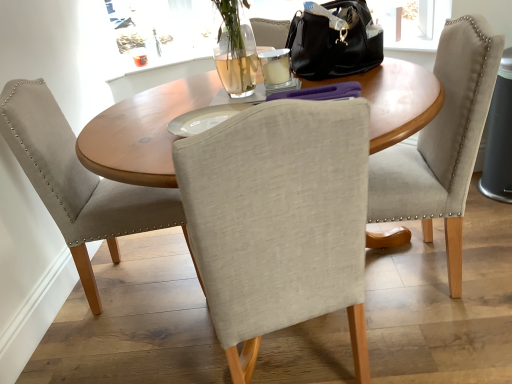
Question: Can you confirm if black leather handbag at upper center is positioned to the left of wooden table at center?

Choices:
 (A) no
 (B) yes

Answer: (A)

Question: Is black leather handbag at upper center next to wooden table at center?

Choices:
 (A) yes
 (B) no

Answer: (B)

Question: Is black leather handbag at upper center smaller than wooden table at center?

Choices:
 (A) yes
 (B) no

Answer: (A)

Question: From the image's perspective, is black leather handbag at upper center above wooden table at center?

Choices:
 (A) yes
 (B) no

Answer: (A)

Question: From a real-world perspective, is black leather handbag at upper center positioned under wooden table at center based on gravity?

Choices:
 (A) no
 (B) yes

Answer: (A)

Question: From the image's perspective, is light gray fabric chair at left, placed as the 1th chair when sorted from left to right, above or below light gray fabric chair at center, acting as the 2th chair starting from the left?

Choices:
 (A) below
 (B) above

Answer: (A)

Question: Is point (37, 148) closer or farther from the camera than point (378, 205)?

Choices:
 (A) closer
 (B) farther

Answer: (B)

Question: In terms of size, does light gray fabric chair at left, placed as the 1th chair when sorted from left to right, appear bigger or smaller than light gray fabric chair at center, which appears as the 1th chair when viewed from the right?

Choices:
 (A) small
 (B) big

Answer: (A)

Question: Considering their positions, is light gray fabric chair at left, placed as the 1th chair when sorted from left to right, located in front of or behind light gray fabric chair at center, which appears as the 1th chair when viewed from the right?

Choices:
 (A) behind
 (B) front

Answer: (A)

Question: Considering the positions of light gray fabric chair at left, the 2th chair positioned from the right, and black leather handbag at upper center in the image, is light gray fabric chair at left, the 2th chair positioned from the right, taller or shorter than black leather handbag at upper center?

Choices:
 (A) tall
 (B) short

Answer: (A)

Question: From a real-world perspective, relative to black leather handbag at upper center, is light gray fabric chair at left, placed as the 1th chair when sorted from left to right, vertically above or below?

Choices:
 (A) below
 (B) above

Answer: (A)

Question: Visually, is light gray fabric chair at left, placed as the 1th chair when sorted from left to right, positioned to the left or to the right of black leather handbag at upper center?

Choices:
 (A) right
 (B) left

Answer: (B)

Question: Relative to black leather handbag at upper center, is light gray fabric chair at left, placed as the 1th chair when sorted from left to right, in front or behind?

Choices:
 (A) behind
 (B) front

Answer: (B)

Question: From a real-world perspective, relative to light gray fabric chair at center, which appears as the 1th chair when viewed from the right, is black leather handbag at upper center vertically above or below?

Choices:
 (A) below
 (B) above

Answer: (B)

Question: Do you think black leather handbag at upper center is within light gray fabric chair at center, acting as the 2th chair starting from the left, or outside of it?

Choices:
 (A) inside
 (B) outside

Answer: (B)